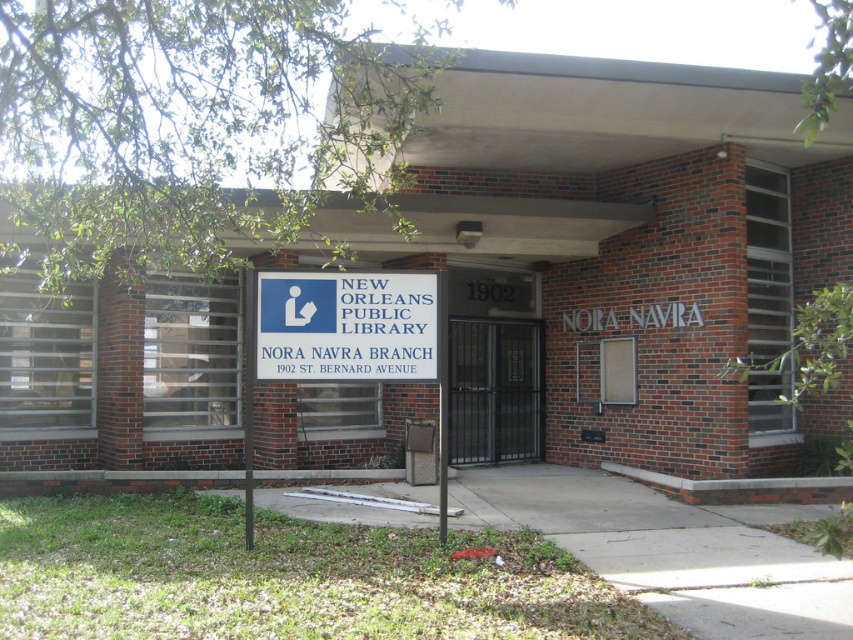
Does blue plastic sign at center appear over metallic gate at center?

Yes.

Does point (412, 285) come behind point (479, 358)?

No, (412, 285) is closer to viewer.

In order to click on blue plastic sign at center in this screenshot , I will do `click(346, 326)`.